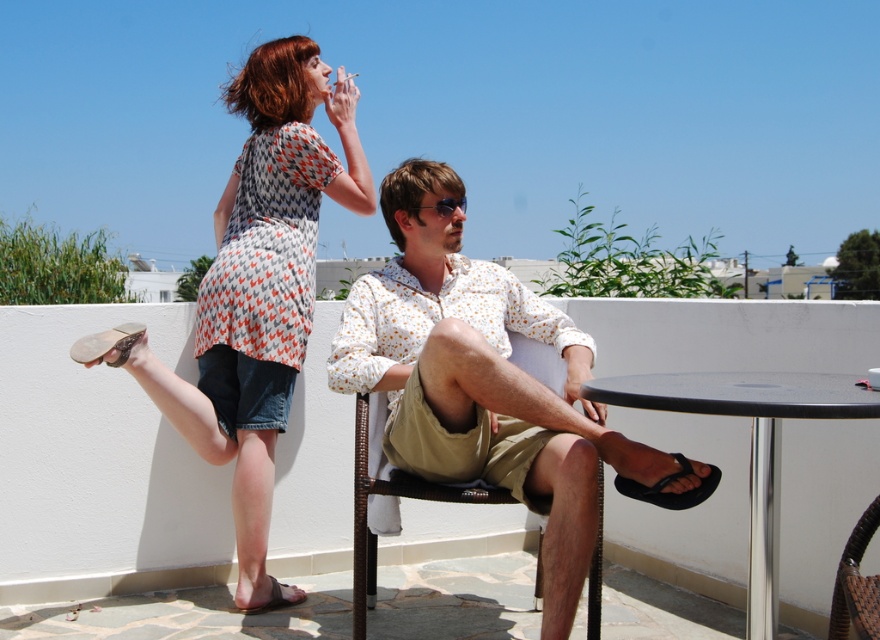
You are a delivery person who needs to place a heavy box on the surface that is lower between the black plastic table at lower right and the woven rattan chair at center. Which object should you choose?

The black plastic table at lower right has a lesser height compared to the woven rattan chair at center, so you should place the heavy box on the black plastic table at lower right.

You are standing on the rooftop terrace and want to place a small potted plant on the black plastic table at lower right. However, you need to ensure that the plant won not block the view of the woven rattan chair at center from where you are standing. Can you do this?

The black plastic table at lower right is in front of the woven rattan chair at center, so placing the potted plant on the table might block the view of the chair. Move the plant to a different location to keep the chair visible.